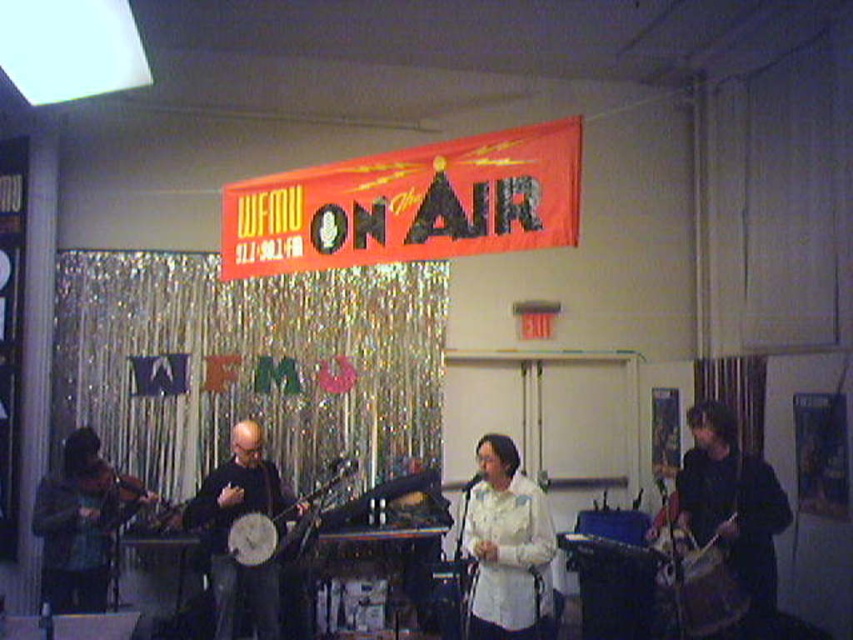
Question: Is white textured shirt at center above black matte banjo at center?

Choices:
 (A) yes
 (B) no

Answer: (A)

Question: Estimate the real-world distances between objects in this image. Which object is closer to the white textured shirt at center?

Choices:
 (A) black matte banjo at center
 (B) dark brown leather drum at right

Answer: (B)

Question: Where is wooden drum at right located in relation to wooden banjo at center in the image?

Choices:
 (A) below
 (B) above

Answer: (A)

Question: Which object is the farthest from the wooden violin at left?

Choices:
 (A) wooden banjo at center
 (B) white textured shirt at center
 (C) wooden drum at right

Answer: (C)

Question: Which point is farther from the camera taking this photo?

Choices:
 (A) (787, 502)
 (B) (113, 499)
 (C) (534, 522)
 (D) (291, 509)

Answer: (D)

Question: Does matte black banjo at center come in front of dark brown leather drum at right?

Choices:
 (A) yes
 (B) no

Answer: (A)